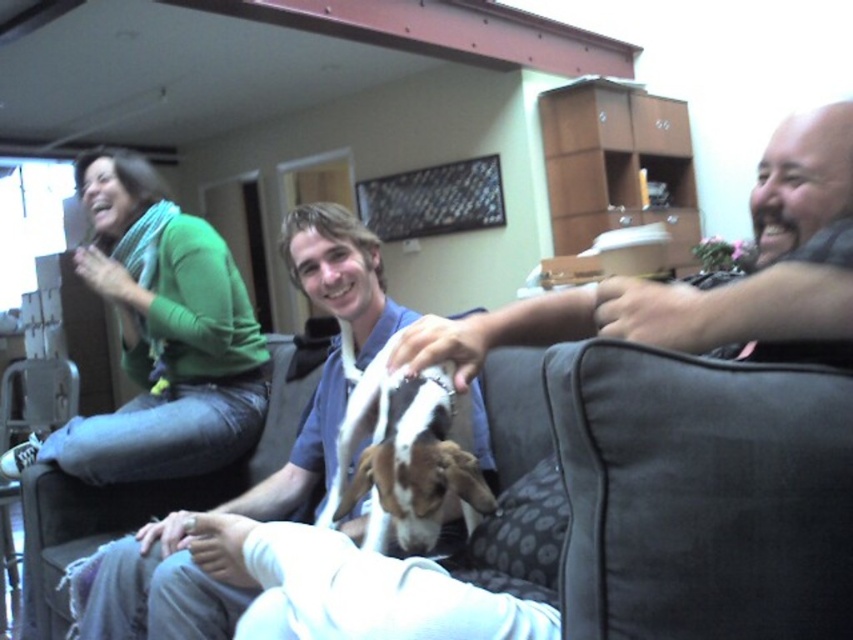
Question: Does green sweater at upper left have a lesser width compared to white soft shirt at center?

Choices:
 (A) no
 (B) yes

Answer: (B)

Question: Which point is farther to the camera?

Choices:
 (A) (253, 348)
 (B) (793, 330)
 (C) (177, 513)
 (D) (436, 476)

Answer: (A)

Question: Does smooth gray shirt at right appear under white fur dog at center?

Choices:
 (A) no
 (B) yes

Answer: (A)

Question: Estimate the real-world distances between objects in this image. Which object is closer to the green sweater at upper left?

Choices:
 (A) white soft shirt at center
 (B) smooth gray shirt at right

Answer: (A)

Question: Which object is closer to the camera taking this photo?

Choices:
 (A) smooth gray shirt at right
 (B) white fur dog at center
 (C) green sweater at upper left

Answer: (A)

Question: Is the position of green sweater at upper left more distant than that of white fur dog at center?

Choices:
 (A) yes
 (B) no

Answer: (A)